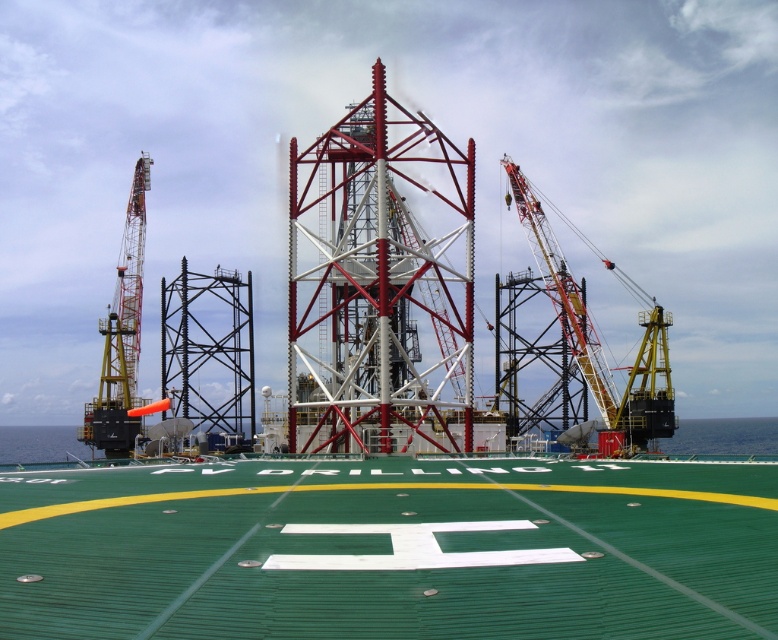
Question: Is metallic red and white tower at center smaller than yellow painted metal crane at left?

Choices:
 (A) yes
 (B) no

Answer: (B)

Question: Which of the following is the farthest from the observer?

Choices:
 (A) yellow painted metal crane at left
 (B) metallic red and white tower at center
 (C) orange painted metal crane at right

Answer: (A)

Question: Among these points, which one is farthest from the camera?

Choices:
 (A) (125, 257)
 (B) (531, 248)

Answer: (A)

Question: Estimate the real-world distances between objects in this image. Which object is closer to the yellow painted metal crane at left?

Choices:
 (A) metallic red and white tower at center
 (B) orange painted metal crane at right

Answer: (A)

Question: Does metallic red and white tower at center appear over yellow painted metal crane at left?

Choices:
 (A) no
 (B) yes

Answer: (B)

Question: Does metallic red and white tower at center appear under yellow painted metal crane at left?

Choices:
 (A) no
 (B) yes

Answer: (A)